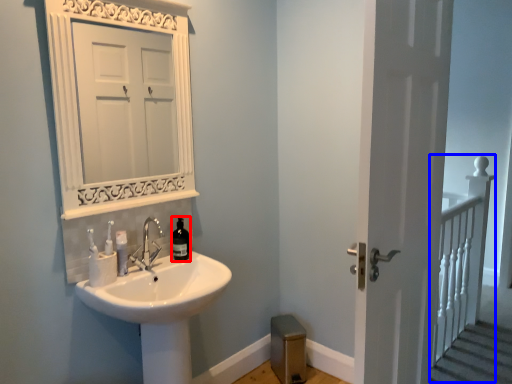
Question: Which object appears closest to the camera in this image, bottle (highlighted by a red box) or rail (highlighted by a blue box)?

Choices:
 (A) bottle
 (B) rail

Answer: (A)